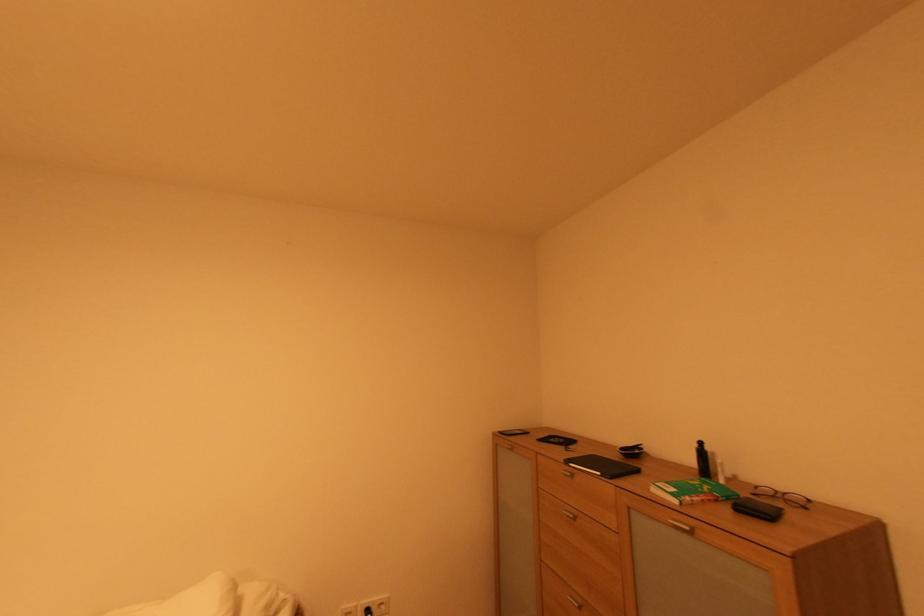
The location [691,491] corresponds to which object?

It corresponds to the green and white box in the image.